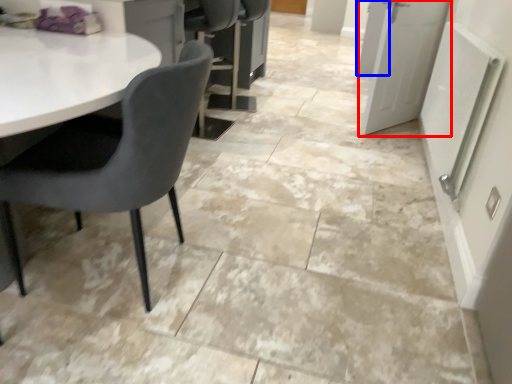
Question: Which point is further to the camera, door (highlighted by a red box) or door (highlighted by a blue box)?

Choices:
 (A) door
 (B) door

Answer: (B)